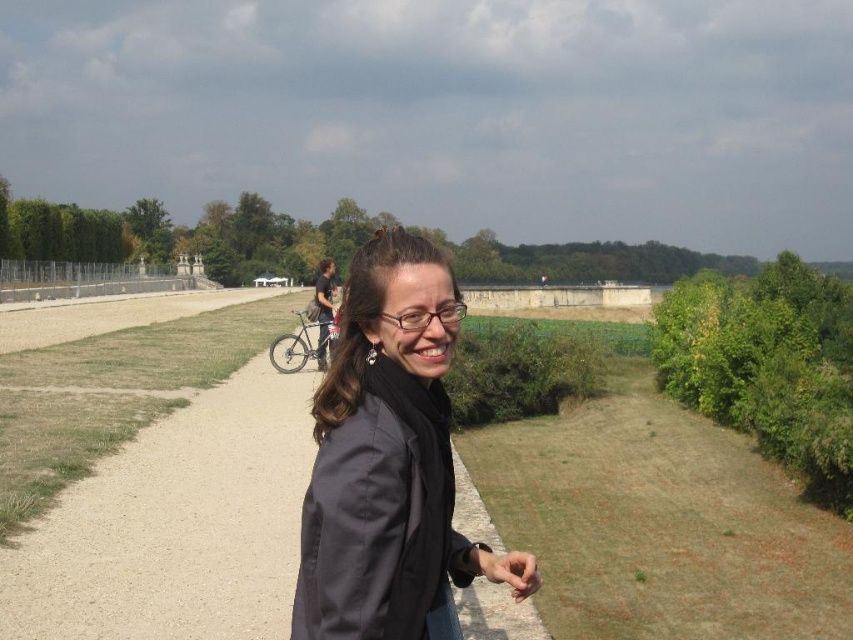
Question: Which object is positioned closest to the matte black hand at center?

Choices:
 (A) smooth gravel path at center
 (B) dark gray jacket at center

Answer: (B)

Question: Is silver metallic bicycle at center thinner than matte black hand at center?

Choices:
 (A) no
 (B) yes

Answer: (A)

Question: Which object is positioned closest to the smooth gravel path at center?

Choices:
 (A) silver metallic bicycle at center
 (B) dark gray jacket at center

Answer: (A)

Question: Is smooth gravel path at center smaller than dark gray jacket at center?

Choices:
 (A) yes
 (B) no

Answer: (B)

Question: Which of these objects is positioned closest to the matte black hand at center?

Choices:
 (A) dark gray jacket at center
 (B) smooth gravel path at center
 (C) silver metallic bicycle at center

Answer: (A)

Question: In this image, where is dark gray jacket at center located relative to matte black hand at center?

Choices:
 (A) right
 (B) left

Answer: (B)